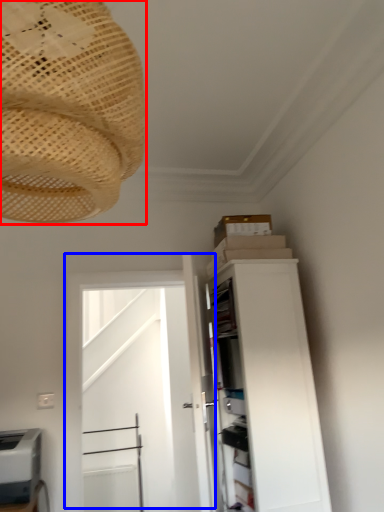
Question: Which of the following is the farthest to the observer, lamp (highlighted by a red box) or door (highlighted by a blue box)?

Choices:
 (A) lamp
 (B) door

Answer: (B)